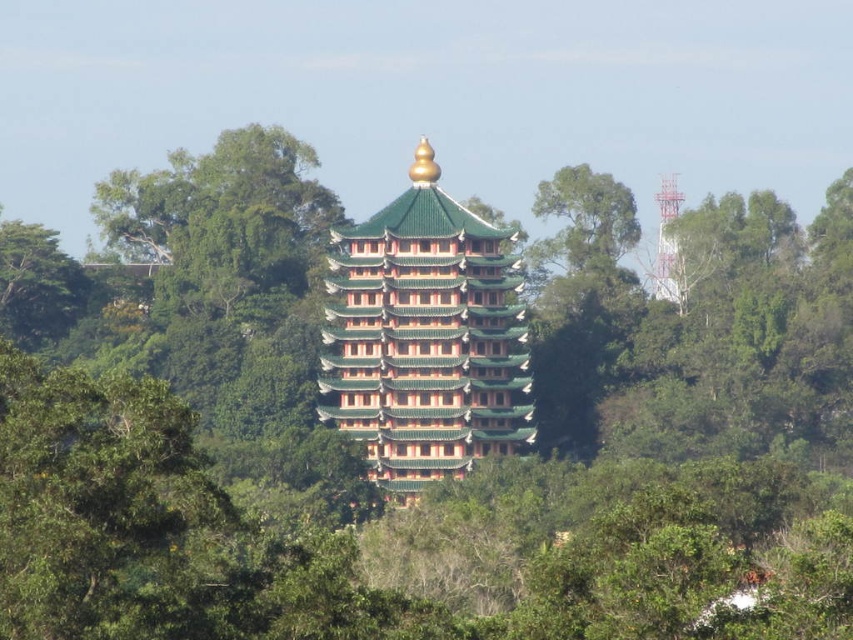
Is point (334, 273) in front of point (659, 266)?

Yes.

Which is behind, point (379, 273) or point (659, 228)?

The point (659, 228) is more distant.

You are a GUI agent. You are given a task and a screenshot of the screen. Output one action in this format:
    pyautogui.click(x=<x>, y=<y>)
    Task: Click on the green glazed tiles at center
    This screenshot has height=640, width=853.
    Given the screenshot: What is the action you would take?
    pyautogui.click(x=425, y=339)

Which is in front, point (589, 193) or point (654, 268)?

Positioned in front is point (589, 193).

Measure the distance between green leafy tree at upper center and white metallic tower at upper center.

37.37 feet

Is point (570, 196) positioned behind point (680, 289)?

Yes, it is.

Image resolution: width=853 pixels, height=640 pixels. In order to click on green leafy tree at upper center in this screenshot , I will do `click(584, 220)`.

Which is more to the right, green glazed tiles at center or green leafy tree at upper center?

green leafy tree at upper center is more to the right.

Between point (344, 413) and point (614, 212), which one is positioned behind?

The point (614, 212) is behind.

I want to click on green glazed tiles at center, so click(425, 339).